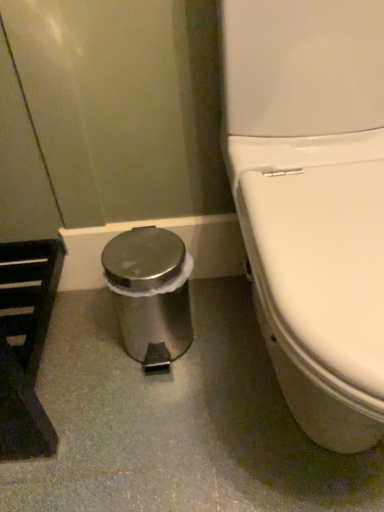
What do you see at coordinates (150, 293) in the screenshot? I see `polished stainless steel trash can at lower left` at bounding box center [150, 293].

Locate an element on the screen. The height and width of the screenshot is (512, 384). polished stainless steel trash can at lower left is located at coordinates (150, 293).

Find the location of a particular element. polished stainless steel trash can at lower left is located at coordinates (150, 293).